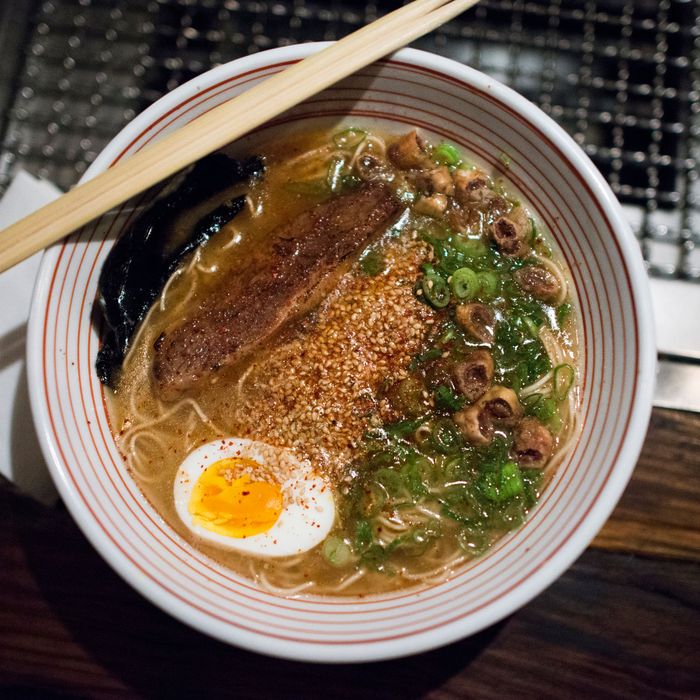
I want to click on bowl, so click(78, 420).